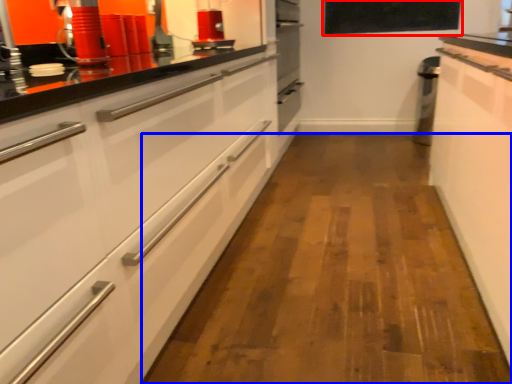
Question: Which point is closer to the camera, window screen (highlighted by a red box) or plain (highlighted by a blue box)?

Choices:
 (A) window screen
 (B) plain

Answer: (B)